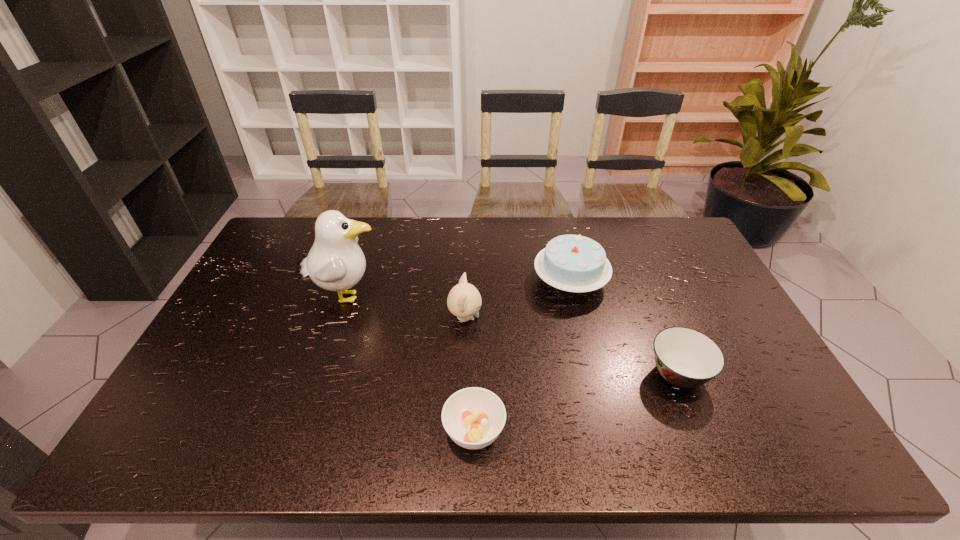
Image resolution: width=960 pixels, height=540 pixels. Find the location of `vacant point located 0.300m on the face of the kitten`. vacant point located 0.300m on the face of the kitten is located at coordinates (584, 318).

This screenshot has height=540, width=960. Identify the location of free space located on the back of the farther soup bowl. (654, 315).

Locate an element on the screen. The width and height of the screenshot is (960, 540). vacant area located 0.080m on the left of the left soup bowl is located at coordinates (409, 431).

Identify the location of object positioned at the near edge. The height and width of the screenshot is (540, 960). (473, 417).

You are a GUI agent. You are given a task and a screenshot of the screen. Output one action in this format:
    pyautogui.click(x=<x>, y=<y>)
    Task: Click on the free space at the far edge of the desktop
    The height and width of the screenshot is (540, 960).
    Given the screenshot: What is the action you would take?
    pyautogui.click(x=420, y=230)

In the image, there is a desktop. Where is `free space at the left edge`? The width and height of the screenshot is (960, 540). free space at the left edge is located at coordinates (260, 340).

In order to click on vacant region at the right edge of the desktop in this screenshot , I will do `click(706, 295)`.

This screenshot has height=540, width=960. In order to click on vacant space at the far right corner of the desktop in this screenshot , I will do pos(689,252).

At what (x,y) coordinates should I click in order to perform the action: click on empty space that is in between the tallest object and the right soup bowl. Please return your answer as a coordinate pair (x, y). The height and width of the screenshot is (540, 960). Looking at the image, I should click on (512, 335).

Identify the location of free spot between the rightmost object and the leftmost object. (512, 335).